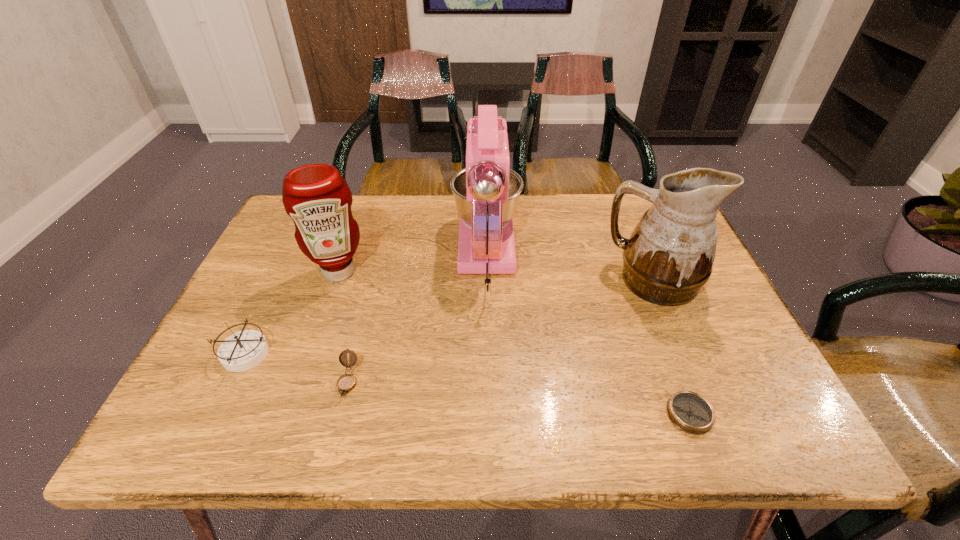
This screenshot has width=960, height=540. Find the location of `object that is the closest to the leftmost compass`. object that is the closest to the leftmost compass is located at coordinates (317, 198).

The image size is (960, 540). In order to click on compass that is the third closest one to the mixer in this screenshot , I will do `click(243, 350)`.

Point out which compass is positioned as the second nearest to the condiment. Please provide its 2D coordinates. Your answer should be formatted as a tuple, i.e. [(x, y)], where the tuple contains the x and y coordinates of a point satisfying the conditions above.

[(345, 383)]

Locate an element on the screen. vacant space that satisfies the following two spatial constraints: 1. from the spout of the pitcher; 2. on the face of the second shortest object is located at coordinates (695, 381).